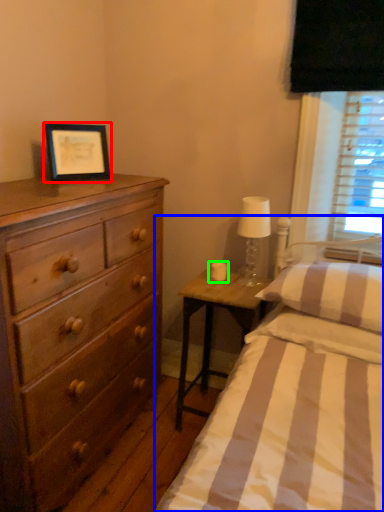
Question: Estimate the real-world distances between objects in this image. Which object is closer to picture frame (highlighted by a red box), bed (highlighted by a blue box) or candle holder (highlighted by a green box)?

Choices:
 (A) bed
 (B) candle holder

Answer: (B)